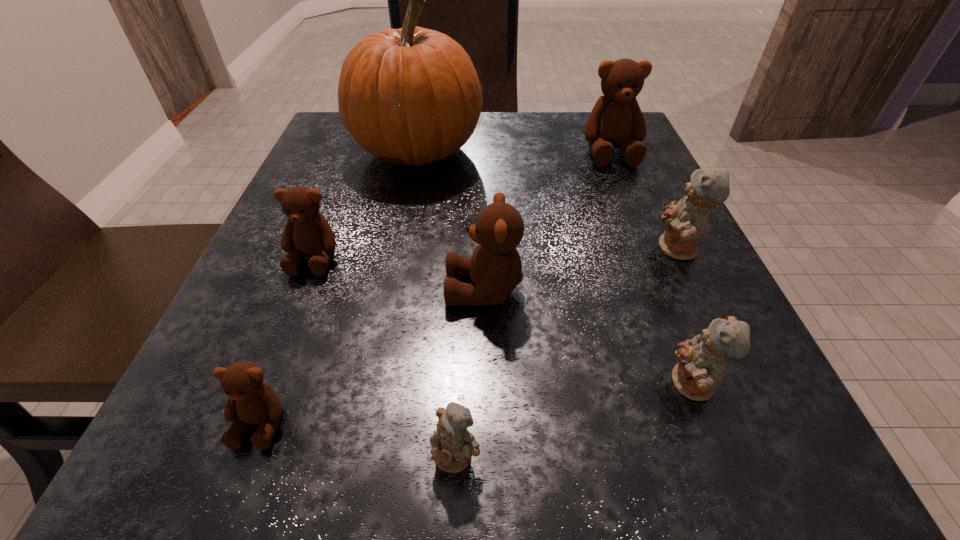
At what (x,y) coordinates should I click in order to perform the action: click on the leftmost blue teddy bear. Please return your answer as a coordinate pair (x, y). Looking at the image, I should click on tap(452, 444).

You are a GUI agent. You are given a task and a screenshot of the screen. Output one action in this format:
    pyautogui.click(x=<x>, y=<y>)
    Task: Click on the smallest blue teddy bear
    
    Given the screenshot: What is the action you would take?
    pyautogui.click(x=452, y=444)

Identify the location of the smallest brown teddy bear. The width and height of the screenshot is (960, 540). pos(251,401).

Find the location of a particular element. vacant area situated 0.180m on the stem of the orange pumpkin is located at coordinates (567, 151).

Image resolution: width=960 pixels, height=540 pixels. I want to click on vacant area situated 0.210m on the face of the biggest brown teddy bear, so click(645, 236).

Where is `vacant area situated 0.230m on the front-facing side of the farthest blue teddy bear`? vacant area situated 0.230m on the front-facing side of the farthest blue teddy bear is located at coordinates (516, 250).

Where is `vacant position located on the front-facing side of the farthest blue teddy bear`? vacant position located on the front-facing side of the farthest blue teddy bear is located at coordinates (528, 250).

Where is `vacant space located on the front-facing side of the farthest blue teddy bear`? vacant space located on the front-facing side of the farthest blue teddy bear is located at coordinates (496, 250).

I want to click on blank space located 0.050m on the face of the third smallest brown teddy bear, so click(x=412, y=290).

Where is `free space located 0.230m on the face of the third smallest brown teddy bear`? free space located 0.230m on the face of the third smallest brown teddy bear is located at coordinates (290, 290).